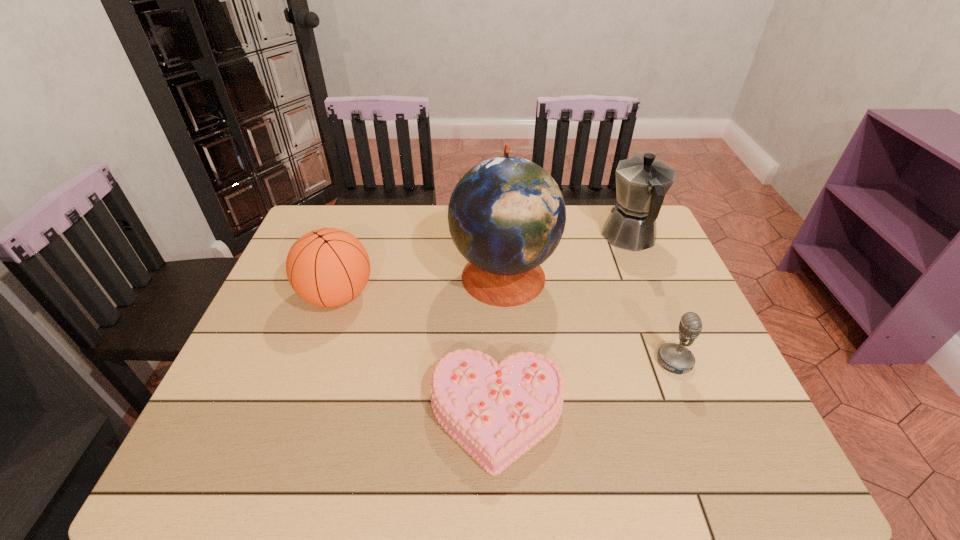
Identify the location of free location located 0.050m on the front-facing side of the fourth tallest object. This screenshot has width=960, height=540. (636, 361).

At what (x,y) coordinates should I click in order to perform the action: click on free space located on the front-facing side of the fourth tallest object. Please return your answer as a coordinate pair (x, y). Looking at the image, I should click on (554, 361).

At what (x,y) coordinates should I click in order to perform the action: click on free point located 0.380m on the front-facing side of the fourth tallest object. Please return your answer as a coordinate pair (x, y). This screenshot has height=540, width=960. Looking at the image, I should click on (493, 361).

Find the location of a particular element. This screenshot has width=960, height=540. vacant area located 0.060m on the left of the shortest object is located at coordinates pos(401,415).

Find the location of a particular element. The height and width of the screenshot is (540, 960). globe at the far edge is located at coordinates (506, 215).

You are a GUI agent. You are given a task and a screenshot of the screen. Output one action in this format:
    pyautogui.click(x=<x>, y=<y>)
    Task: Click on the coffeepot that is at the far edge
    The image size is (960, 540).
    Given the screenshot: What is the action you would take?
    pyautogui.click(x=641, y=182)

Where is `object that is at the near edge`? object that is at the near edge is located at coordinates (496, 411).

Locate an element on the screen. The width and height of the screenshot is (960, 540). object that is at the left edge is located at coordinates coord(327,267).

Locate an element on the screen. coffeepot present at the right edge is located at coordinates (641, 182).

You are a GUI agent. You are given a task and a screenshot of the screen. Output one action in this format:
    pyautogui.click(x=<x>, y=<y>)
    Task: Click on the microphone that is positioned at the right edge
    The width and height of the screenshot is (960, 540).
    Given the screenshot: What is the action you would take?
    pyautogui.click(x=676, y=358)